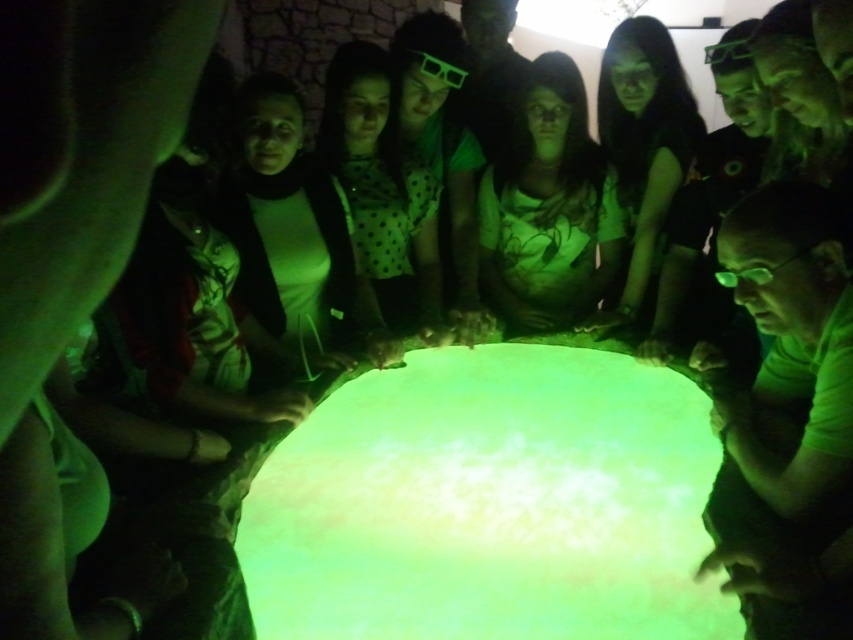
Question: From the image, what is the correct spatial relationship of green glowing surface at center in relation to white matte shirt at center?

Choices:
 (A) above
 (B) below

Answer: (B)

Question: Is green glowing surface at center wider than white matte shirt at center?

Choices:
 (A) no
 (B) yes

Answer: (B)

Question: Among these points, which one is nearest to the camera?

Choices:
 (A) (577, 401)
 (B) (508, 214)

Answer: (A)

Question: Observing the image, what is the correct spatial positioning of green glowing surface at center in reference to white matte shirt at center?

Choices:
 (A) above
 (B) below

Answer: (B)

Question: Which point is farther to the camera?

Choices:
 (A) (605, 240)
 (B) (363, 609)

Answer: (A)